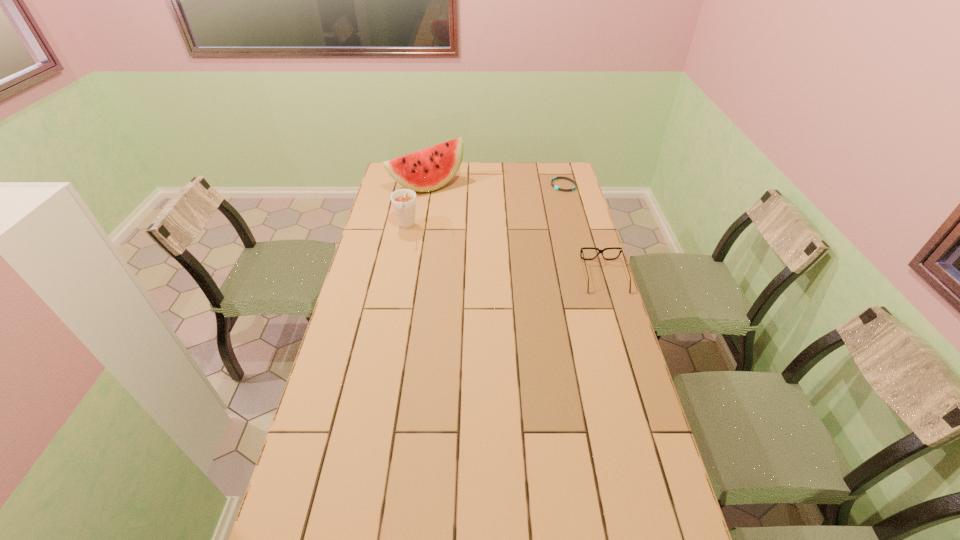
Where is `the third farthest object`? This screenshot has width=960, height=540. the third farthest object is located at coordinates (403, 200).

At what (x,y) coordinates should I click in order to perform the action: click on the second shortest object. Please return your answer as a coordinate pair (x, y). The height and width of the screenshot is (540, 960). Looking at the image, I should click on 581,251.

The image size is (960, 540). What are the coordinates of `spectacles` in the screenshot? It's located at (581, 251).

At what (x,y) coordinates should I click in order to perform the action: click on watermelon. Please return your answer as a coordinate pair (x, y). Looking at the image, I should click on (429, 169).

Where is `the shortest object`? This screenshot has width=960, height=540. the shortest object is located at coordinates (555, 187).

The image size is (960, 540). In order to click on vacant space situated 0.190m on the drink side of the root beer in this screenshot , I will do `click(398, 268)`.

The width and height of the screenshot is (960, 540). Identify the location of vacant space located with the lenses facing outward on the nearest object. (633, 371).

In order to click on vacant space located on the outer rind of the watermelon in this screenshot , I will do `click(452, 202)`.

This screenshot has height=540, width=960. In order to click on free space located on the outer rind of the watermelon in this screenshot , I will do `click(475, 222)`.

Locate an element on the screen. The width and height of the screenshot is (960, 540). blank area located 0.090m on the outer rind of the watermelon is located at coordinates (456, 205).